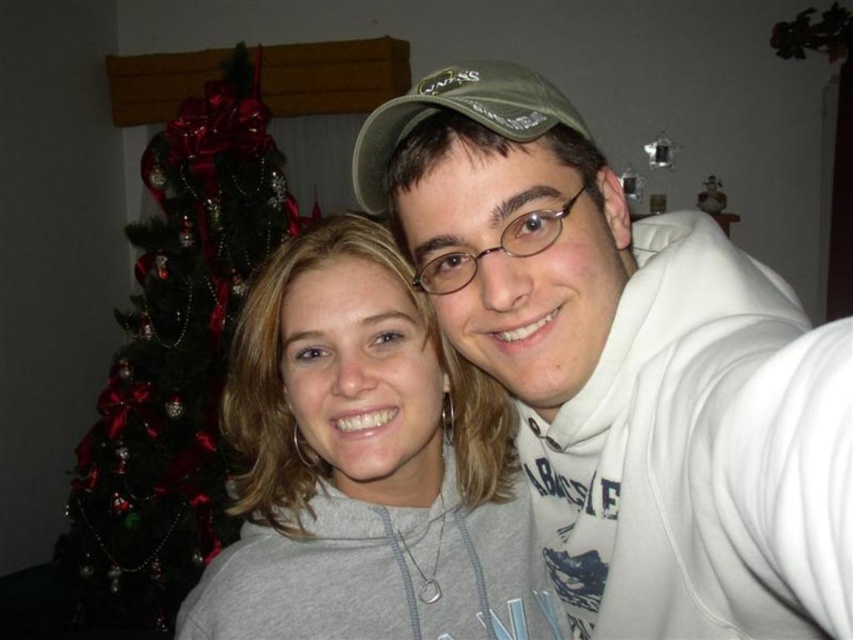
You are trying to take a selfie with your friend in front of the green matte christmas tree at left. Your friend is wearing the green fabric baseball cap at upper center. To ensure the cap is clearly visible in the photo, should you position your friend in front of or behind the tree?

The green fabric baseball cap at upper center is behind the green matte christmas tree at left, so to make the cap visible, your friend should be positioned in front of the tree instead of behind it.

You are a delivery robot with a package that is 1.5 meters wide. You need to move from the entrance to the Christmas tree in the image. Is there enough space between the green matte christmas tree at left and the green fabric baseball cap at upper center for your package to pass through?

The distance between the green matte christmas tree at left and the green fabric baseball cap at upper center is 1.72 meters. Since the package is 1.5 meters wide, there is sufficient space for the package to pass through.

You are planning to take a photo of both the green matte christmas tree at left and the green fabric baseball cap at upper center. Since the camera can only focus on one object at a time, which one should you choose to ensure it appears larger in the photo?

The green matte christmas tree at left is bigger than the green fabric baseball cap at upper center, so you should choose the green matte christmas tree at left to ensure it appears larger in the photo.